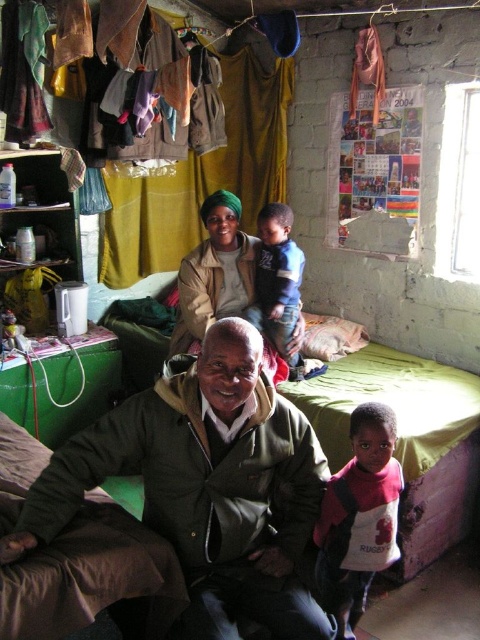
Question: Is green fabric bed at center thinner than matte beige jacket at center?

Choices:
 (A) no
 (B) yes

Answer: (A)

Question: Is matte beige jacket at center further to camera compared to blue cotton shirt at center?

Choices:
 (A) yes
 (B) no

Answer: (B)

Question: Is green fabric bed at center above matte beige jacket at center?

Choices:
 (A) no
 (B) yes

Answer: (A)

Question: Which of the following is the closest to the observer?

Choices:
 (A) 184,480
 (B) 336,440
 (C) 363,438

Answer: (A)

Question: Which of the following is the farthest from the observer?

Choices:
 (A) dark green fabric at center
 (B) matte beige jacket at center

Answer: (B)

Question: Which is nearer to the green matte jacket at center?

Choices:
 (A) blue cotton shirt at center
 (B) green fabric bed at center
 (C) dark green fabric at center

Answer: (C)